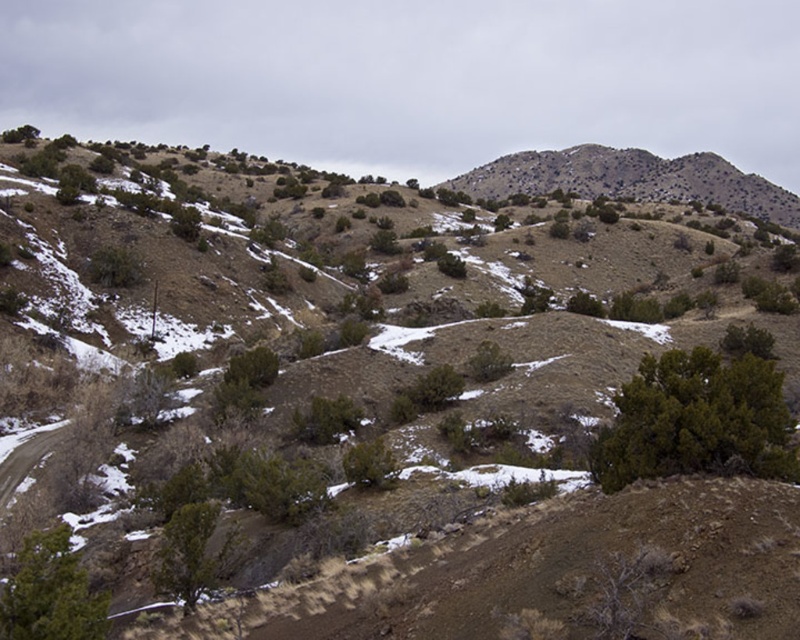
Question: Which object is the farthest from the green leafy shrub at lower left?

Choices:
 (A) green matte tree at lower left
 (B) green leafy bush at lower right

Answer: (B)

Question: Estimate the real-world distances between objects in this image. Which object is farther from the green matte tree at lower left?

Choices:
 (A) desert brown hill at upper right
 (B) green leafy bush at lower right
 (C) green leafy shrub at lower left

Answer: (A)

Question: Does desert brown hill at upper right have a lesser width compared to green matte tree at lower left?

Choices:
 (A) yes
 (B) no

Answer: (B)

Question: Is the position of green matte tree at lower left less distant than that of green leafy shrub at lower left?

Choices:
 (A) no
 (B) yes

Answer: (B)

Question: In this image, where is green leafy bush at lower right located relative to desert brown hill at upper right?

Choices:
 (A) above
 (B) below

Answer: (B)

Question: Which point is farther to the camera?

Choices:
 (A) (218, 509)
 (B) (664, 172)

Answer: (B)